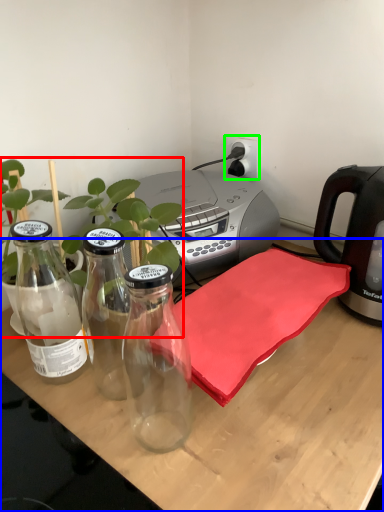
Question: Considering the real-world distances, which object is farthest from plant (highlighted by a red box)? desk (highlighted by a blue box) or electric outlet (highlighted by a green box)?

Choices:
 (A) desk
 (B) electric outlet

Answer: (B)